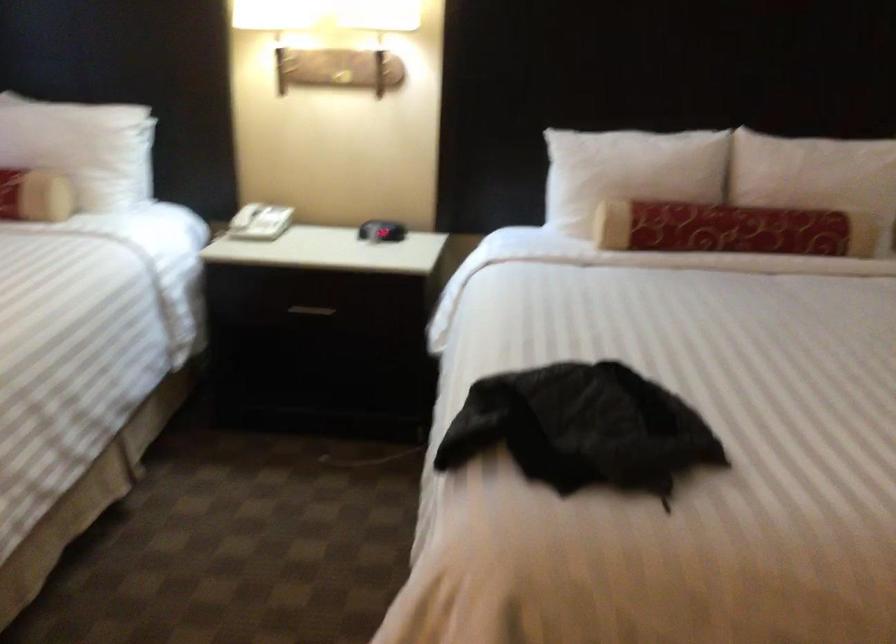
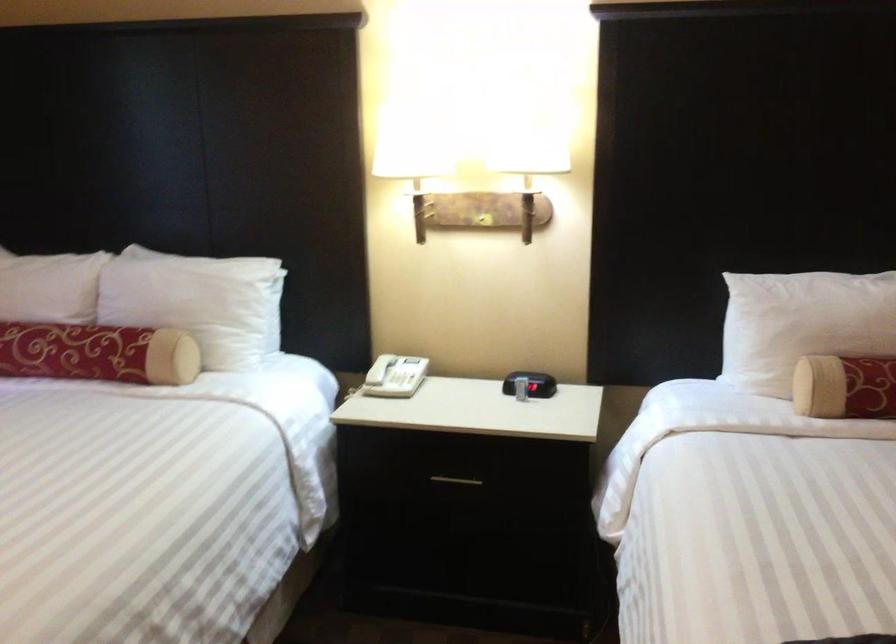
Find the pixel in the second image that matches (246,216) in the first image.

(380, 368)